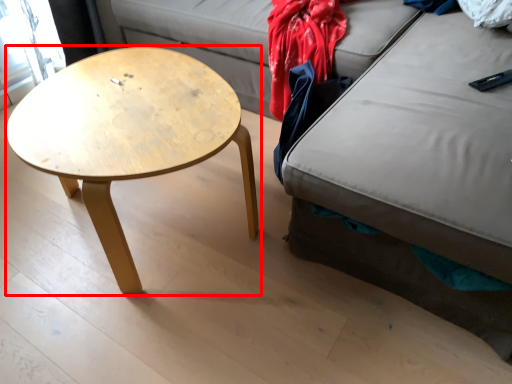
Question: From the image's perspective, what is the correct spatial positioning of coffee table (annotated by the red box) in reference to clothing?

Choices:
 (A) below
 (B) above

Answer: (A)